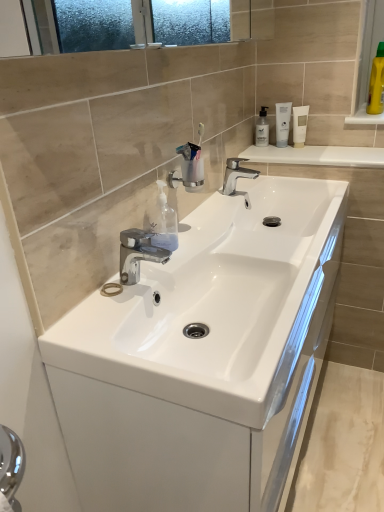
You are a GUI agent. You are given a task and a screenshot of the screen. Output one action in this format:
    pyautogui.click(x=<x>, y=<y>)
    Task: Click on the free spot to the right of transparent plastic soap dispenser at center
    The image size is (384, 512).
    Given the screenshot: What is the action you would take?
    pyautogui.click(x=208, y=241)